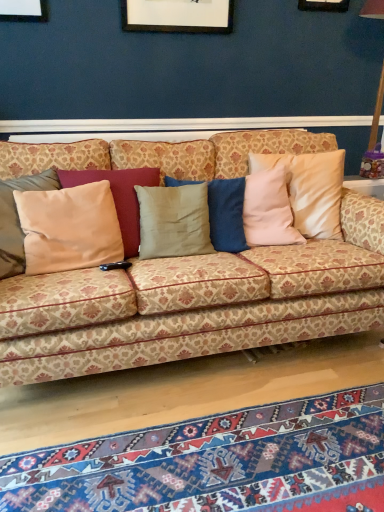
Question: Do you think textured wool mat at lower center is within satin beige pillow at left, or outside of it?

Choices:
 (A) outside
 (B) inside

Answer: (A)

Question: Is textured wool mat at lower center wider or thinner than satin beige pillow at left?

Choices:
 (A) wide
 (B) thin

Answer: (A)

Question: Estimate the real-world distances between objects in this image. Which object is closer to the satin beige pillow at left?

Choices:
 (A) patterned fabric couch at center
 (B) textured wool mat at lower center

Answer: (A)

Question: Which of these objects is positioned farthest from the patterned fabric couch at center?

Choices:
 (A) satin beige pillow at left
 (B) textured wool mat at lower center

Answer: (B)